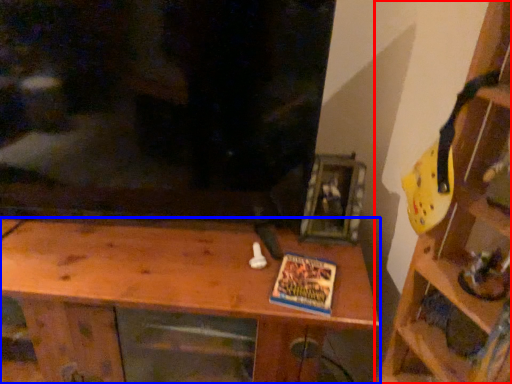
Question: Which point is further to the camera, shelf (highlighted by a red box) or shelf (highlighted by a blue box)?

Choices:
 (A) shelf
 (B) shelf

Answer: (B)